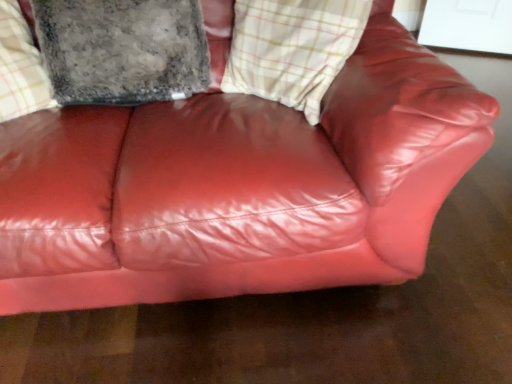
Question: Considering the positions of fuzzy gray pillow at upper left and plaid fabric cushion at upper center in the image, is fuzzy gray pillow at upper left wider or thinner than plaid fabric cushion at upper center?

Choices:
 (A) thin
 (B) wide

Answer: (B)

Question: Relative to plaid fabric cushion at upper center, is fuzzy gray pillow at upper left in front or behind?

Choices:
 (A) behind
 (B) front

Answer: (A)

Question: From a real-world perspective, is fuzzy gray pillow at upper left above or below plaid fabric cushion at upper center?

Choices:
 (A) above
 (B) below

Answer: (A)

Question: From a real-world perspective, relative to fuzzy gray pillow at upper left, is plaid fabric cushion at upper center vertically above or below?

Choices:
 (A) below
 (B) above

Answer: (A)

Question: In terms of width, does plaid fabric cushion at upper center look wider or thinner when compared to fuzzy gray pillow at upper left?

Choices:
 (A) thin
 (B) wide

Answer: (A)

Question: Looking at the image, does plaid fabric cushion at upper center seem bigger or smaller compared to fuzzy gray pillow at upper left?

Choices:
 (A) big
 (B) small

Answer: (B)

Question: Choose the correct answer: Is plaid fabric cushion at upper center inside fuzzy gray pillow at upper left or outside it?

Choices:
 (A) inside
 (B) outside

Answer: (B)